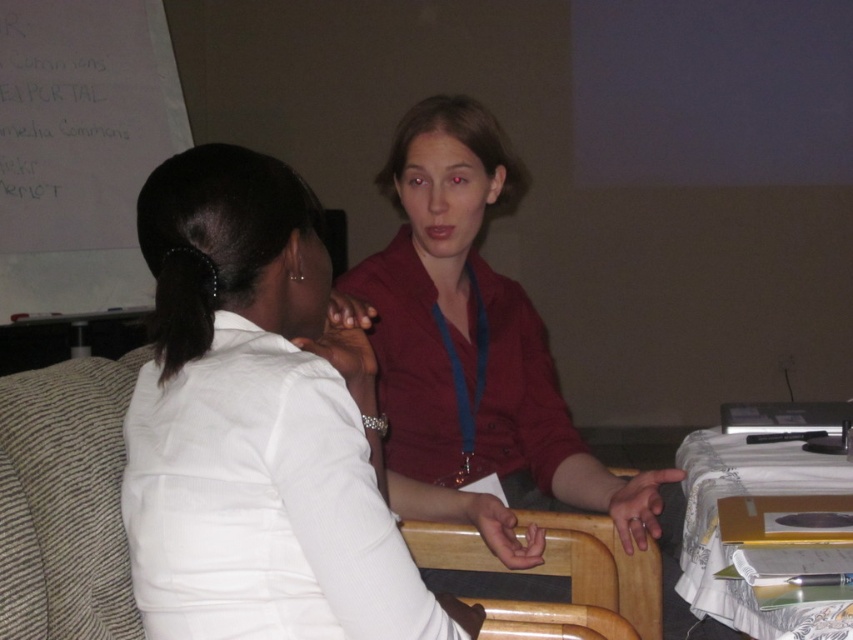
You are organizing a meeting and need to place a new folder on the table. The folder is the same size as the beech wood chair at center. Will the white paper at upper left fit the folder?

The white paper at upper left is bigger than the beech wood chair at center, so the folder, which is the same size as the beech wood chair at center, will fit on the white paper at upper left.

You are an assistant organizing a meeting. You need to place a name tag on the table so that it is between the matte red blouse at upper center and the matte red shirt at center. Is this possible?

The matte red blouse at upper center is positioned under the matte red shirt at center, so placing a name tag between them would require placing it in the space between the two objects along the vertical axis. Since they are vertically aligned with one under the other, there is no horizontal space between them to place the name tag between them.